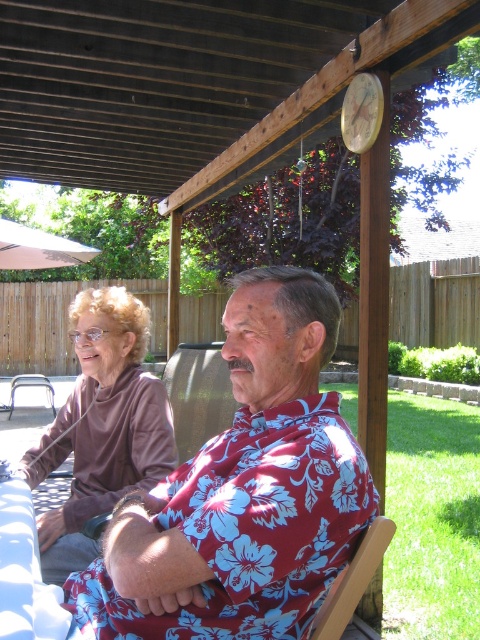
Question: Observing the image, what is the correct spatial positioning of floral print shirt at center in reference to white fabric umbrella at upper left?

Choices:
 (A) below
 (B) above

Answer: (A)

Question: Can you confirm if white fabric umbrella at upper left is positioned above metallic silver chair at left?

Choices:
 (A) no
 (B) yes

Answer: (B)

Question: Which object is farther from the camera taking this photo?

Choices:
 (A) wooden chair at lower right
 (B) brown fleece sweater at left
 (C) white fabric umbrella at upper left
 (D) floral print shirt at center

Answer: (C)

Question: Which point is closer to the camera?

Choices:
 (A) (132, 362)
 (B) (52, 264)
 (C) (238, 365)
 (D) (27, 385)

Answer: (C)

Question: Which point is closer to the camera taking this photo?

Choices:
 (A) (115, 288)
 (B) (12, 268)
 (C) (348, 614)

Answer: (C)

Question: Does floral print shirt at center have a greater width compared to wooden chair at lower right?

Choices:
 (A) yes
 (B) no

Answer: (A)